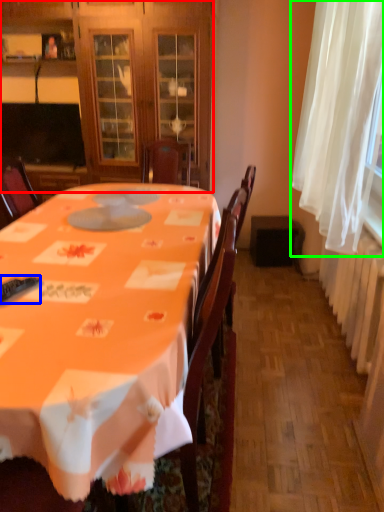
Question: Considering the real-world distances, which object is farthest from cabinetry (highlighted by a red box)? remote control (highlighted by a blue box) or curtain (highlighted by a green box)?

Choices:
 (A) remote control
 (B) curtain

Answer: (A)